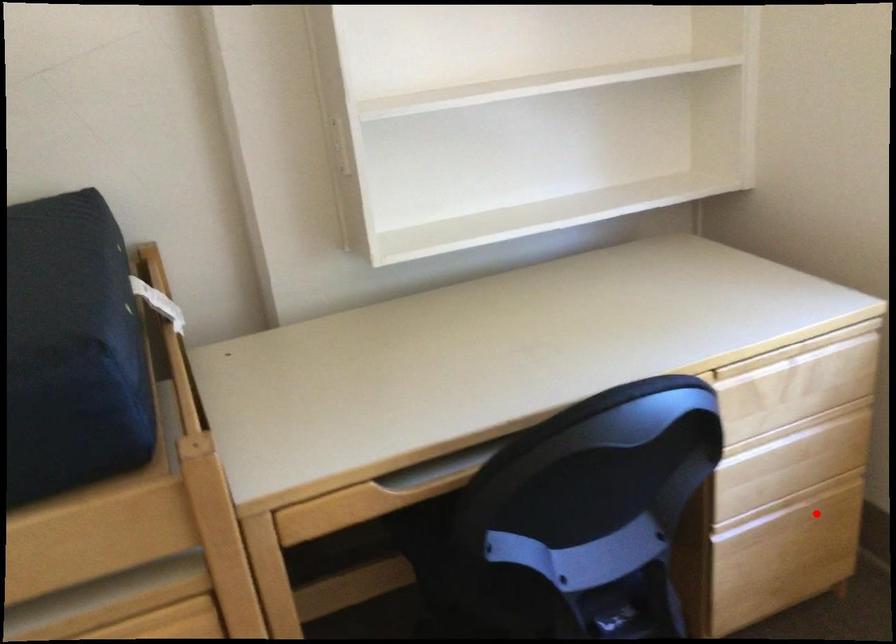
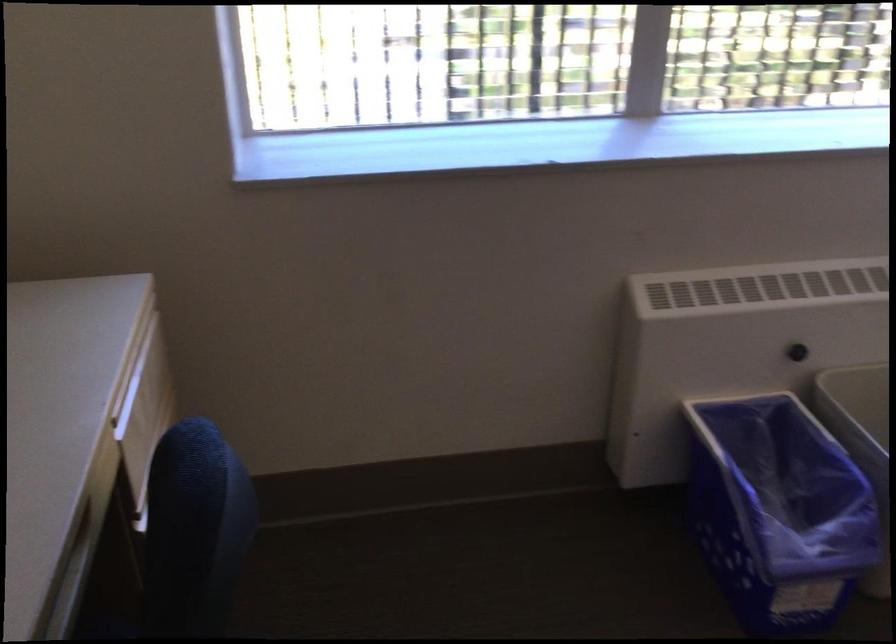
Question: I am providing you with two images of the same scene from different viewpoints. A red point is marked on the first image. Is the red point's position out of view in image 2?

Choices:
 (A) Yes
 (B) No

Answer: (A)